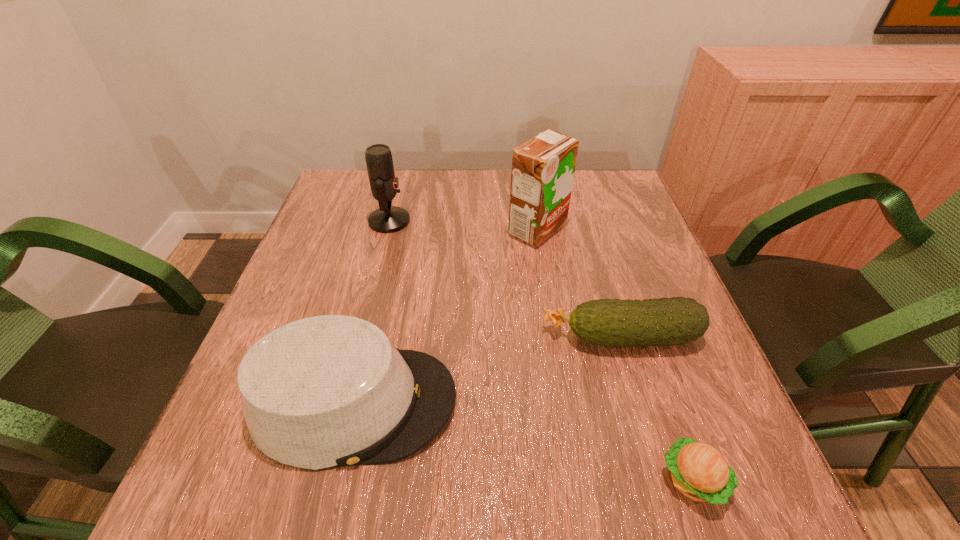
Identify the location of vacant space located at the blossom end of the cucumber. This screenshot has width=960, height=540. (476, 336).

The image size is (960, 540). Find the location of `blank space located 0.110m at the blossom end of the cucumber`. blank space located 0.110m at the blossom end of the cucumber is located at coordinates (487, 336).

The image size is (960, 540). Identify the location of free space located at the blossom end of the cucumber. (400, 336).

Locate an element on the screen. The width and height of the screenshot is (960, 540). free space located on the back of the shortest object is located at coordinates (638, 321).

Image resolution: width=960 pixels, height=540 pixels. Find the location of `carton present at the far edge`. carton present at the far edge is located at coordinates (543, 168).

Locate an element on the screen. The width and height of the screenshot is (960, 540). microphone that is at the far edge is located at coordinates (387, 219).

Where is `hat at the near edge`? The image size is (960, 540). hat at the near edge is located at coordinates (327, 391).

The height and width of the screenshot is (540, 960). I want to click on hamburger situated at the near edge, so [699, 471].

Find the location of a particular element. This screenshot has height=540, width=960. microphone that is at the left edge is located at coordinates (387, 219).

You are a GUI agent. You are given a task and a screenshot of the screen. Output one action in this format:
    pyautogui.click(x=<x>, y=<y>)
    Task: Click on the hat that is positioned at the left edge
    The image size is (960, 540).
    Given the screenshot: What is the action you would take?
    pyautogui.click(x=327, y=391)